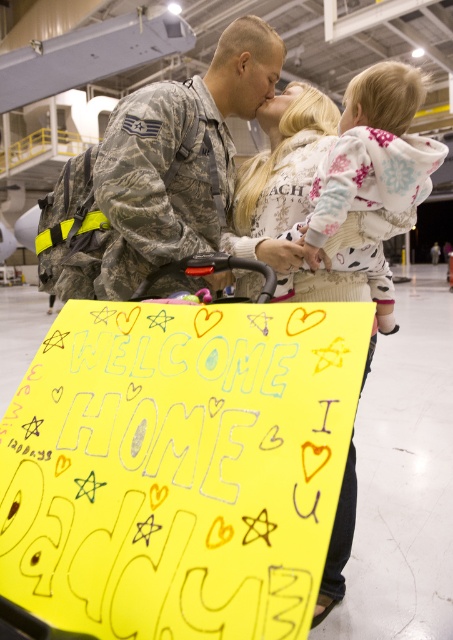
Question: Estimate the real-world distances between objects in this image. Which object is closer to the camouflage uniform at center?

Choices:
 (A) white fleece hoodie at upper center
 (B) white fleece sweater at center

Answer: (B)

Question: Which point appears farthest from the camera in this image?

Choices:
 (A) (420, 77)
 (B) (266, 204)
 (C) (125, 141)

Answer: (B)

Question: Among these points, which one is nearest to the camera?

Choices:
 (A) (225, 45)
 (B) (308, 241)

Answer: (B)

Question: Is camouflage uniform at center below white fleece sweater at center?

Choices:
 (A) no
 (B) yes

Answer: (A)

Question: Can you confirm if camouflage uniform at center is wider than white fleece hoodie at upper center?

Choices:
 (A) yes
 (B) no

Answer: (A)

Question: Is camouflage uniform at center to the right of white fleece hoodie at upper center from the viewer's perspective?

Choices:
 (A) yes
 (B) no

Answer: (B)